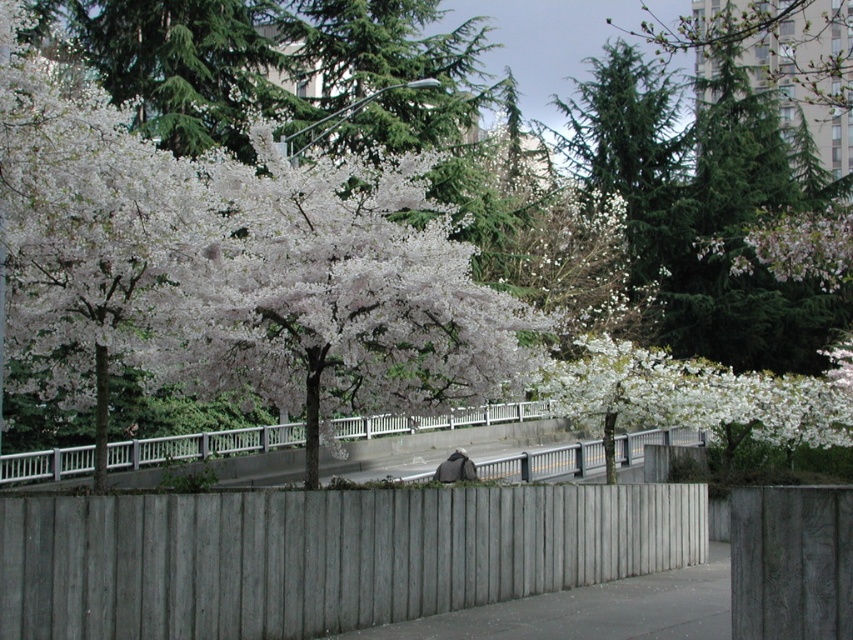
Is white wood fence at center behind dark gray fabric bag at center?

That is False.

Which is more to the right, white wood fence at center or dark gray fabric bag at center?

dark gray fabric bag at center

Where is `white wood fence at center`? Image resolution: width=853 pixels, height=640 pixels. white wood fence at center is located at coordinates (202, 445).

Find the location of `white wood fence at center`. white wood fence at center is located at coordinates (202, 445).

Who is shorter, gray concrete pavement at center or dark gray fabric bag at center?

With less height is gray concrete pavement at center.

Which is behind, point (648, 593) or point (450, 468)?

The point (450, 468) is more distant.

In order to click on gray concrete pavement at center in this screenshot , I will do `click(590, 611)`.

What do you see at coordinates (321, 556) in the screenshot? This screenshot has width=853, height=640. I see `gray wood fence at center` at bounding box center [321, 556].

Is point (439, 608) less distant than point (442, 461)?

Yes, it is.

Does point (119, 618) come farther from viewer compared to point (442, 465)?

That is False.

This screenshot has height=640, width=853. I want to click on gray wood fence at center, so click(321, 556).